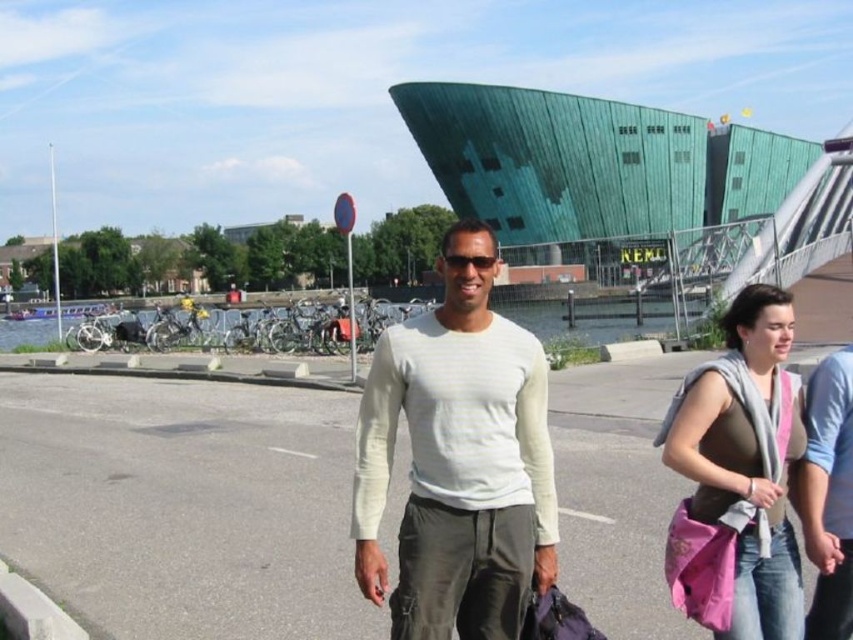
Is green glass pedestrian bridge at upper center to the left of sunglasses at center from the viewer's perspective?

Incorrect, green glass pedestrian bridge at upper center is not on the left side of sunglasses at center.

What do you see at coordinates (630, 189) in the screenshot?
I see `green glass pedestrian bridge at upper center` at bounding box center [630, 189].

Who is more forward, (401, 109) or (485, 262)?

Positioned in front is point (485, 262).

Locate an element on the screen. Image resolution: width=853 pixels, height=640 pixels. green glass pedestrian bridge at upper center is located at coordinates (630, 189).

Is pink fabric bag at lower right further to the viewer compared to sunglasses at center?

No, it is not.

Can you confirm if pink fabric bag at lower right is positioned to the right of sunglasses at center?

Correct, you'll find pink fabric bag at lower right to the right of sunglasses at center.

The height and width of the screenshot is (640, 853). Describe the element at coordinates (746, 460) in the screenshot. I see `pink fabric bag at lower right` at that location.

In order to click on pink fabric bag at lower right in this screenshot , I will do `click(746, 460)`.

Who is taller, green glass pedestrian bridge at upper center or white cotton shirt at center?

Standing taller between the two is green glass pedestrian bridge at upper center.

Looking at this image, between green glass pedestrian bridge at upper center and white cotton shirt at center, which one has less height?

With less height is white cotton shirt at center.

Measure the distance between point [680,202] and camera.

They are 91.15 meters apart.

Identify the location of green glass pedestrian bridge at upper center. (630, 189).